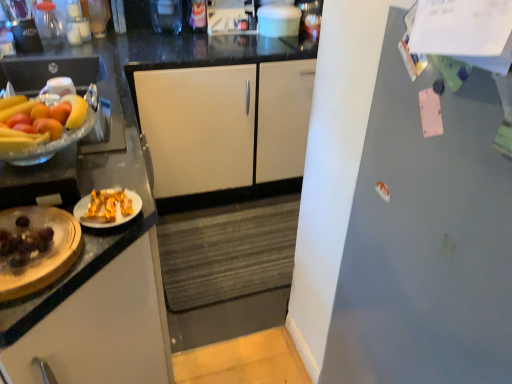
Question: Would you say white matte cabinet at center, which is the 2th cabinetry in front-to-back order, is part of gray matte refrigerator at right's contents?

Choices:
 (A) yes
 (B) no

Answer: (B)

Question: Considering the relative positions of gray matte refrigerator at right and white matte cabinet at center, which is counted as the second cabinetry, starting from the bottom, in the image provided, is gray matte refrigerator at right to the right of white matte cabinet at center, which is counted as the second cabinetry, starting from the bottom, from the viewer's perspective?

Choices:
 (A) yes
 (B) no

Answer: (A)

Question: Is gray matte refrigerator at right at the left side of white matte cabinet at center, which is counted as the second cabinetry, starting from the bottom?

Choices:
 (A) no
 (B) yes

Answer: (A)

Question: Considering the relative sizes of gray matte refrigerator at right and white matte cabinet at center, which is the 2th cabinetry in front-to-back order, in the image provided, is gray matte refrigerator at right smaller than white matte cabinet at center, which is the 2th cabinetry in front-to-back order,?

Choices:
 (A) no
 (B) yes

Answer: (A)

Question: Is gray matte refrigerator at right not inside white matte cabinet at center, marked as the first cabinetry in a top-to-bottom arrangement?

Choices:
 (A) yes
 (B) no

Answer: (A)

Question: Is gray matte refrigerator at right wider or thinner than yellow matte banana at left?

Choices:
 (A) thin
 (B) wide

Answer: (B)

Question: Considering the positions of gray matte refrigerator at right and yellow matte banana at left in the image, is gray matte refrigerator at right taller or shorter than yellow matte banana at left?

Choices:
 (A) short
 (B) tall

Answer: (B)

Question: Relative to yellow matte banana at left, is gray matte refrigerator at right in front or behind?

Choices:
 (A) front
 (B) behind

Answer: (A)

Question: In the image, is gray matte refrigerator at right on the left side or the right side of yellow matte banana at left?

Choices:
 (A) left
 (B) right

Answer: (B)

Question: From a real-world perspective, is yellow matte banana at left physically located above or below white matte cabinet at center, which is the 2th cabinetry in front-to-back order?

Choices:
 (A) above
 (B) below

Answer: (A)

Question: In terms of height, does yellow matte banana at left look taller or shorter compared to white matte cabinet at center, marked as the first cabinetry in a top-to-bottom arrangement?

Choices:
 (A) tall
 (B) short

Answer: (B)

Question: From the image's perspective, is yellow matte banana at left above or below white matte cabinet at center, marked as the first cabinetry in a top-to-bottom arrangement?

Choices:
 (A) above
 (B) below

Answer: (B)

Question: Would you say yellow matte banana at left is to the left or to the right of white matte cabinet at center, which is counted as the second cabinetry, starting from the bottom, in the picture?

Choices:
 (A) right
 (B) left

Answer: (B)

Question: In terms of width, does white matte cabinet at center, which is counted as the second cabinetry, starting from the bottom, look wider or thinner when compared to yellow matte banana at left?

Choices:
 (A) thin
 (B) wide

Answer: (B)

Question: From a real-world perspective, is white matte cabinet at center, which is counted as the second cabinetry, starting from the bottom, above or below yellow matte banana at left?

Choices:
 (A) below
 (B) above

Answer: (A)